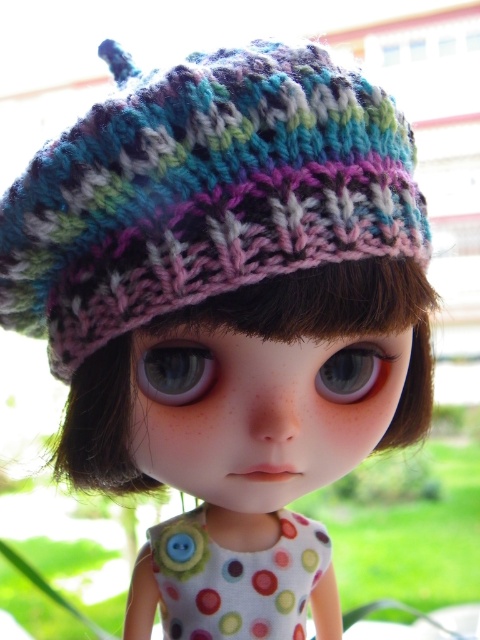
You are a doll maker who needs to ensure the eyes are properly aligned. Given that the distance between the brown matte eye at center and the blue glossy eye at center must be exactly 9.36 centimeters, does the current placement meet the requirement?

Yes, the current placement meets the requirement because the brown matte eye at center is exactly 9.36 centimeters away from the blue glossy eye at center as specified.

You are a tailor who wants to create a dress that matches the doll. Given that the doll has a blue glossy eye at center and a polka dot fabric dress at center, which one should you focus on in terms of size when designing the dress?

The polka dot fabric dress at center has a greater height compared to the blue glossy eye at center, so you should focus on the size of the polka dot fabric dress at center when designing the dress to ensure proper proportions.